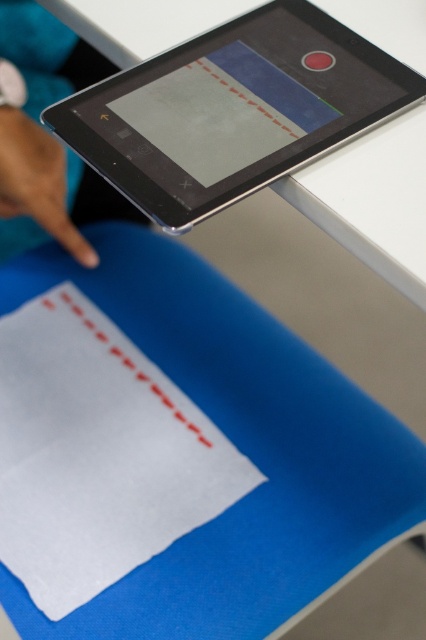
From the picture: Does matte black tablet at upper center have a greater height compared to matte skin hand at upper left?

Yes.

Is matte black tablet at upper center above matte skin hand at upper left?

Yes, matte black tablet at upper center is above matte skin hand at upper left.

The image size is (426, 640). What are the coordinates of `matte black tablet at upper center` in the screenshot? It's located at (232, 109).

Where is `white matte paper at lower left`? The height and width of the screenshot is (640, 426). white matte paper at lower left is located at coordinates (97, 452).

Can you confirm if white matte paper at lower left is smaller than matte black tablet at upper center?

Actually, white matte paper at lower left might be larger than matte black tablet at upper center.

Does point (143, 480) come farther from viewer compared to point (342, 74)?

Yes, point (143, 480) is farther from viewer.

In order to click on white matte paper at lower left in this screenshot , I will do `click(97, 452)`.

Measure the distance between point (x=149, y=525) and camera.

36.19 inches

Is white matte paper at lower left further to the viewer compared to matte skin hand at upper left?

That is False.

Between point (58, 433) and point (92, 259), which one is positioned in front?

Point (58, 433) is more forward.

At what (x,y) coordinates should I click in order to perform the action: click on white matte paper at lower left. Please return your answer as a coordinate pair (x, y). This screenshot has width=426, height=640. Looking at the image, I should click on (97, 452).